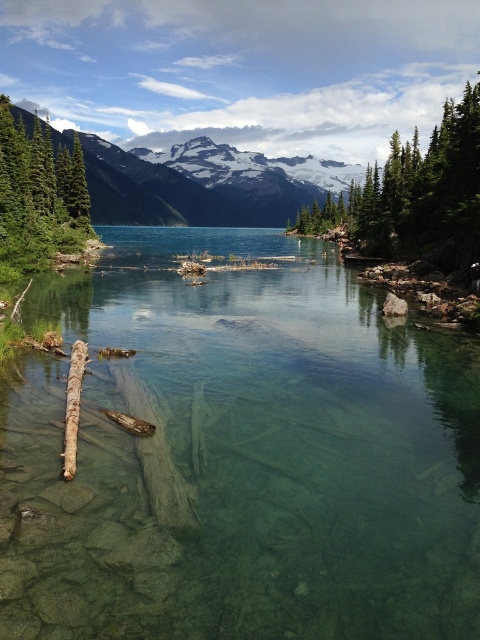
Question: Is clear glassy water at center below snowy granite mountain at upper center?

Choices:
 (A) yes
 (B) no

Answer: (A)

Question: Is snowy granite mountain at upper center bigger than brown rough log at lower left?

Choices:
 (A) yes
 (B) no

Answer: (A)

Question: Is clear glassy water at center smaller than snowy granite mountain at upper center?

Choices:
 (A) no
 (B) yes

Answer: (B)

Question: Which point is closer to the camera?

Choices:
 (A) green leafy tree at upper right
 (B) snowy granite mountain at upper center
 (C) brown rough log at lower left
 (D) clear glassy water at center

Answer: (D)

Question: Which point is closer to the camera?

Choices:
 (A) clear glassy water at center
 (B) green matte tree at upper left
 (C) brown rough log at lower left
 (D) snowy granite mountain at upper center

Answer: (A)

Question: Estimate the real-world distances between objects in this image. Which object is closer to the green leafy tree at upper right?

Choices:
 (A) green matte tree at upper left
 (B) snowy granite mountain at upper center
 (C) brown rough log at lower left
 (D) clear glassy water at center

Answer: (D)